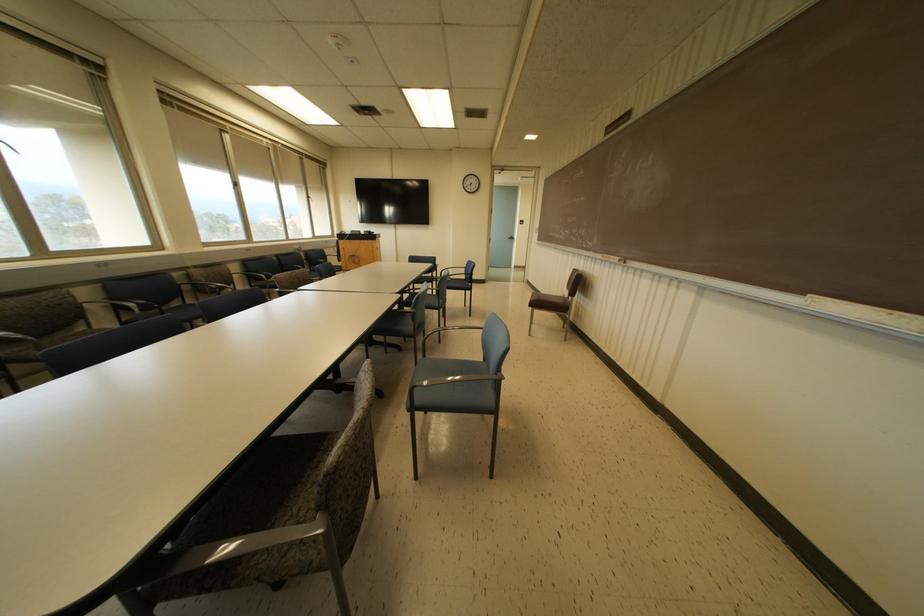
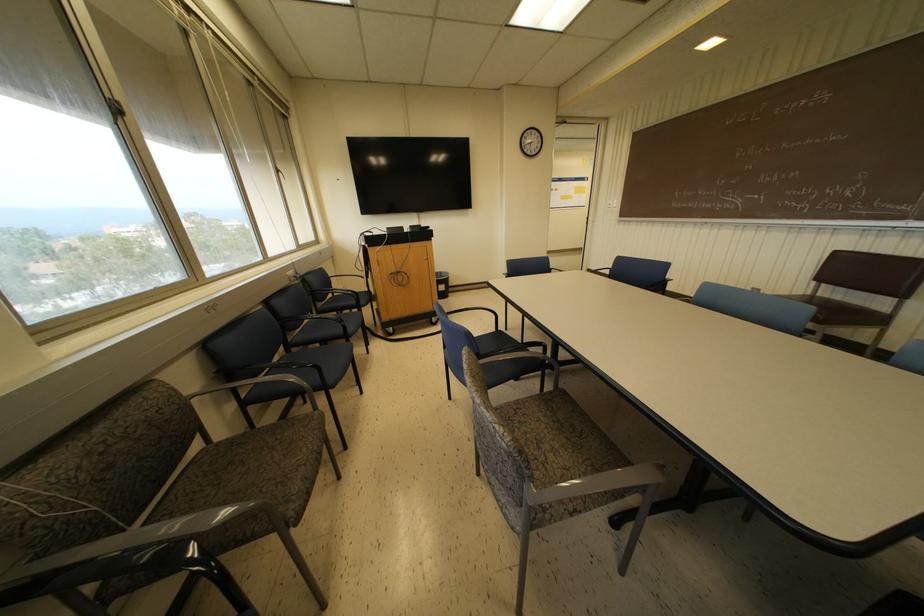
What movement of the cameraman would produce the second image?

The movement direction of the cameraman is left, forward.